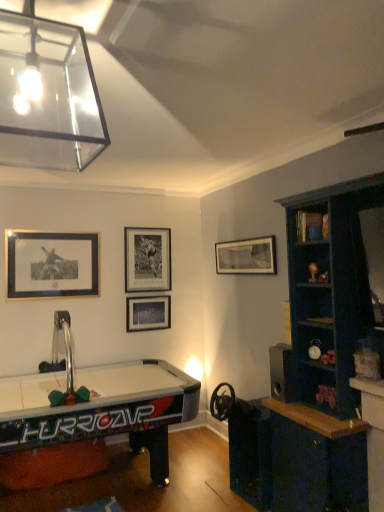
Question: Can you confirm if black matte picture frame at upper center, marked as the 1th picture frame in a right-to-left arrangement, is positioned to the right of black matte picture frame at upper center, the second picture frame positioned from the left?

Choices:
 (A) no
 (B) yes

Answer: (B)

Question: Is black matte picture frame at upper center, placed as the fourth picture frame when sorted from left to right, smaller than black matte picture frame at upper center, the second picture frame positioned from the left?

Choices:
 (A) no
 (B) yes

Answer: (A)

Question: Can you confirm if black matte picture frame at upper center, placed as the fourth picture frame when sorted from left to right, is thinner than black matte picture frame at upper center, the second picture frame positioned from the left?

Choices:
 (A) no
 (B) yes

Answer: (A)

Question: Is black matte picture frame at upper center, marked as the 1th picture frame in a right-to-left arrangement, at the left side of black matte picture frame at upper center, the 3th picture frame viewed from the right?

Choices:
 (A) no
 (B) yes

Answer: (A)

Question: From a real-world perspective, is black matte picture frame at upper center, marked as the 1th picture frame in a right-to-left arrangement, located higher than black matte picture frame at upper center, the second picture frame positioned from the left?

Choices:
 (A) yes
 (B) no

Answer: (B)

Question: From the image's perspective, is matte black picture frame at center, the third picture frame in the left-to-right sequence, positioned above or below wooden bookshelf at upper right?

Choices:
 (A) below
 (B) above

Answer: (A)

Question: In terms of size, does matte black picture frame at center, positioned as the second picture frame in right-to-left order, appear bigger or smaller than wooden bookshelf at upper right?

Choices:
 (A) big
 (B) small

Answer: (A)

Question: Is matte black picture frame at center, the third picture frame in the left-to-right sequence, inside or outside of wooden bookshelf at upper right?

Choices:
 (A) outside
 (B) inside

Answer: (A)

Question: Is matte black picture frame at center, positioned as the second picture frame in right-to-left order, in front of or behind wooden bookshelf at upper right in the image?

Choices:
 (A) behind
 (B) front

Answer: (A)

Question: From their relative heights in the image, would you say black matte picture frame at upper center, marked as the 1th picture frame in a right-to-left arrangement, is taller or shorter than black matte picture frame at upper center, the second picture frame positioned from the left?

Choices:
 (A) short
 (B) tall

Answer: (A)

Question: Is black matte picture frame at upper center, placed as the fourth picture frame when sorted from left to right, wider or thinner than black matte picture frame at upper center, the second picture frame positioned from the left?

Choices:
 (A) thin
 (B) wide

Answer: (B)

Question: Considering the positions of point (264, 246) and point (134, 271), is point (264, 246) closer or farther from the camera than point (134, 271)?

Choices:
 (A) farther
 (B) closer

Answer: (B)

Question: Do you think black matte picture frame at upper center, marked as the 1th picture frame in a right-to-left arrangement, is within black matte picture frame at upper center, the 3th picture frame viewed from the right, or outside of it?

Choices:
 (A) outside
 (B) inside

Answer: (A)

Question: Based on their positions, is matte black picture frame at center, positioned as the second picture frame in right-to-left order, located to the left or right of gold metallic picture frame at upper left, marked as the 4th picture frame in a right-to-left arrangement?

Choices:
 (A) right
 (B) left

Answer: (A)

Question: In terms of height, does matte black picture frame at center, the third picture frame in the left-to-right sequence, look taller or shorter compared to gold metallic picture frame at upper left, the 1th picture frame from the left?

Choices:
 (A) tall
 (B) short

Answer: (B)